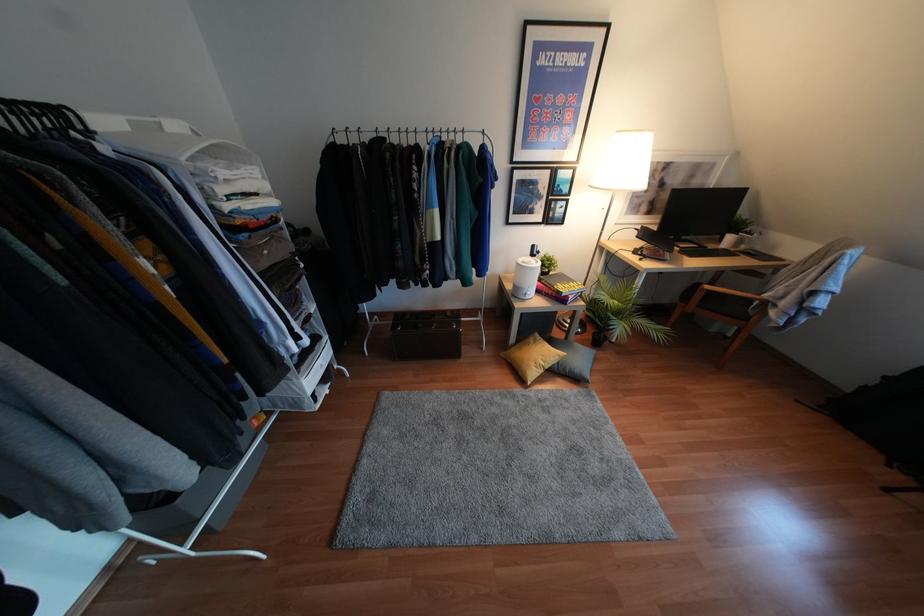
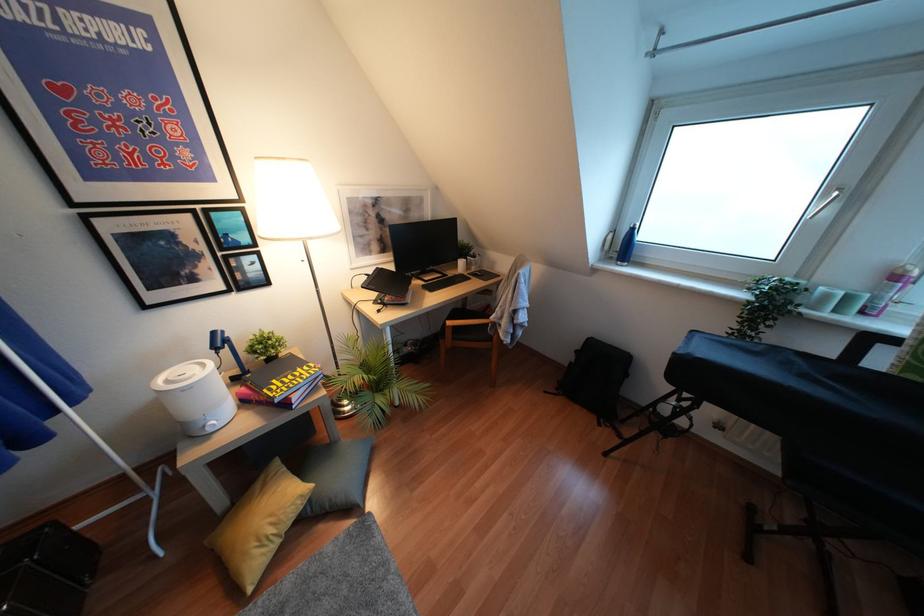
Question: The first image is from the beginning of the video and the second image is from the end. How did the camera likely rotate when shooting the video?

Choices:
 (A) Left
 (B) Right
 (C) Up
 (D) Down

Answer: (B)